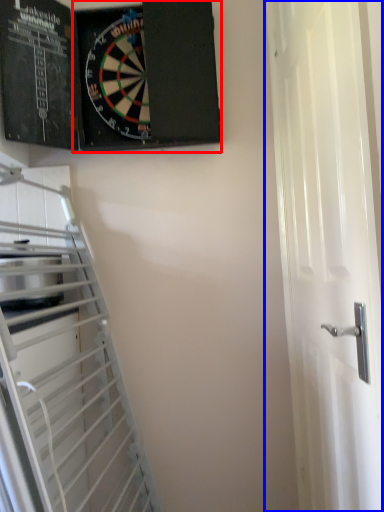
Question: Which object appears closest to the camera in this image, bulletin board (highlighted by a red box) or door (highlighted by a blue box)?

Choices:
 (A) bulletin board
 (B) door

Answer: (B)